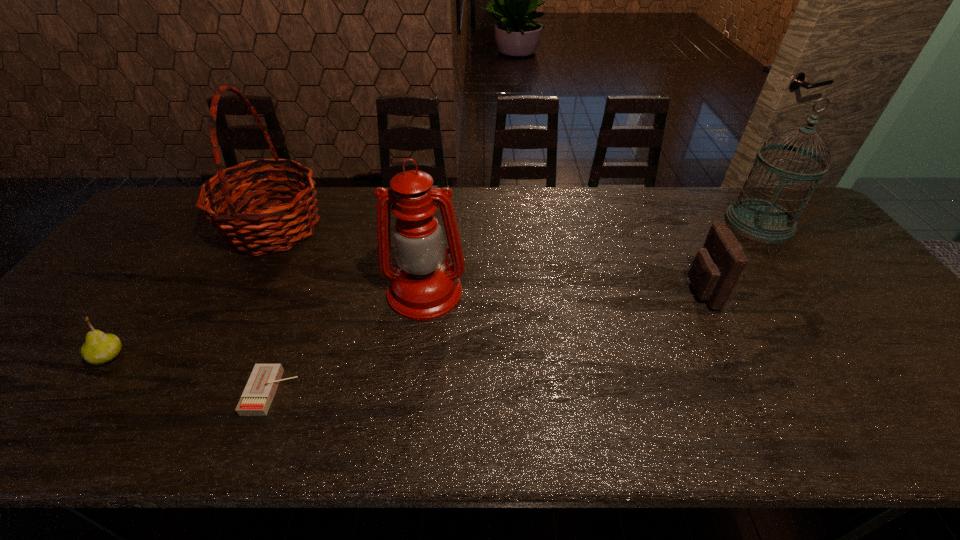
This screenshot has width=960, height=540. What are the coordinates of `empty space that is in between the basket and the oil lamp` in the screenshot? It's located at (349, 260).

This screenshot has height=540, width=960. Find the location of `free space between the basket and the pear`. free space between the basket and the pear is located at coordinates (191, 292).

This screenshot has height=540, width=960. I want to click on empty space that is in between the pouch and the matchbox, so click(486, 342).

Find the location of a particular element. Image resolution: width=960 pixels, height=540 pixels. vacant space that is in between the third object from right to left and the fifth tallest object is located at coordinates pyautogui.click(x=267, y=325).

Where is `the third closest object relative to the second object from right to left`? the third closest object relative to the second object from right to left is located at coordinates (260, 389).

Find the location of `object that can be found as the fifth closest to the shortest object`. object that can be found as the fifth closest to the shortest object is located at coordinates (759, 220).

Identify the location of free location that satisfies the following two spatial constraints: 1. on the front-facing side of the rightmost object; 2. with an open flap on the third shortest object. (808, 291).